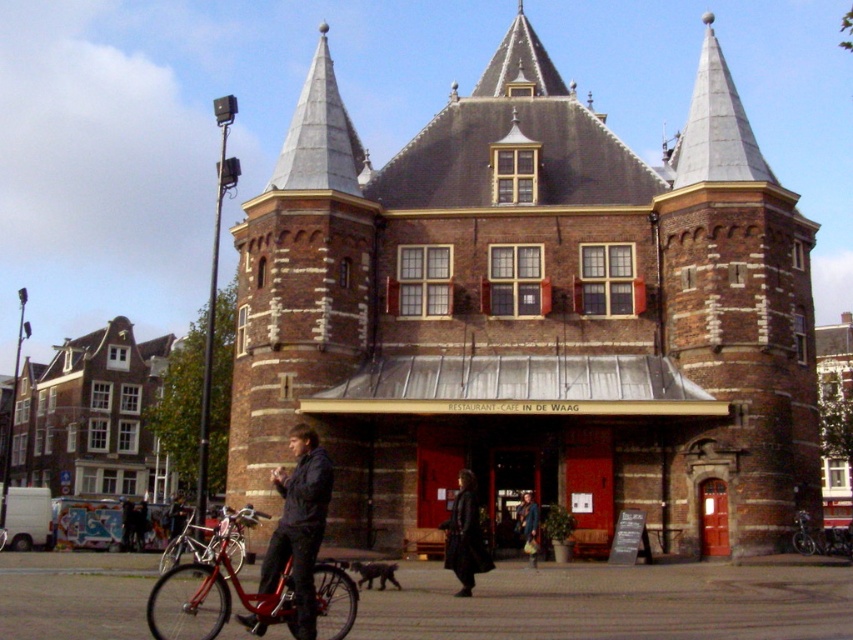
Who is more distant from viewer, (x=701, y=200) or (x=310, y=515)?

The point (x=701, y=200) is more distant.

The width and height of the screenshot is (853, 640). What do you see at coordinates (531, 316) in the screenshot?
I see `brown brick building at center` at bounding box center [531, 316].

Find the location of a particular element. brown brick building at center is located at coordinates (531, 316).

Is brown brick building at center in front of dark brown leather coat at center?

No.

Is brown brick building at center further to camera compared to dark brown leather coat at center?

Yes.

At what (x,y) coordinates should I click in order to perform the action: click on brown brick building at center. Please return your answer as a coordinate pair (x, y). The height and width of the screenshot is (640, 853). Looking at the image, I should click on (531, 316).

Based on the photo, who is more distant from viewer, (393,376) or (531,554)?

Positioned behind is point (393,376).

The width and height of the screenshot is (853, 640). In order to click on brown brick building at center in this screenshot , I will do point(531,316).

Which is behind, point (407, 472) or point (525, 547)?

The point (407, 472) is more distant.

Locate an element on the screen. brown brick building at center is located at coordinates (531, 316).